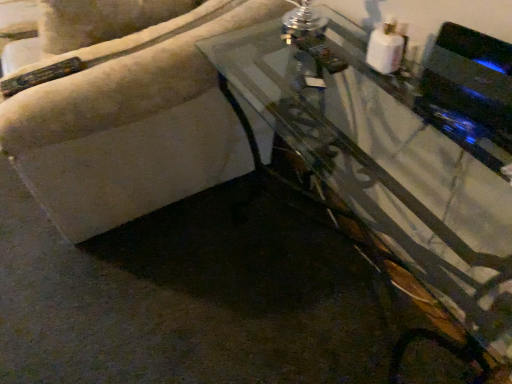
Question: From the image's perspective, is black glossy speaker at upper right located beneath transparent glass table at center?

Choices:
 (A) yes
 (B) no

Answer: (B)

Question: Is black glossy speaker at upper right positioned before transparent glass table at center?

Choices:
 (A) yes
 (B) no

Answer: (B)

Question: Is black glossy speaker at upper right in contact with transparent glass table at center?

Choices:
 (A) no
 (B) yes

Answer: (A)

Question: Is black glossy speaker at upper right thinner than transparent glass table at center?

Choices:
 (A) no
 (B) yes

Answer: (B)

Question: Can you confirm if black glossy speaker at upper right is positioned to the left of transparent glass table at center?

Choices:
 (A) yes
 (B) no

Answer: (B)

Question: From a real-world perspective, is black glossy speaker at upper right under transparent glass table at center?

Choices:
 (A) yes
 (B) no

Answer: (B)

Question: Considering the relative sizes of transparent glass table at center and black glossy speaker at upper right in the image provided, is transparent glass table at center taller than black glossy speaker at upper right?

Choices:
 (A) yes
 (B) no

Answer: (A)

Question: Does transparent glass table at center have a larger size compared to black glossy speaker at upper right?

Choices:
 (A) yes
 (B) no

Answer: (A)

Question: From the image's perspective, is transparent glass table at center above black glossy speaker at upper right?

Choices:
 (A) yes
 (B) no

Answer: (B)

Question: Could you tell me if transparent glass table at center is facing black glossy speaker at upper right?

Choices:
 (A) no
 (B) yes

Answer: (A)

Question: Does transparent glass table at center have a greater width compared to black glossy speaker at upper right?

Choices:
 (A) no
 (B) yes

Answer: (B)

Question: Would you consider transparent glass table at center to be distant from black glossy speaker at upper right?

Choices:
 (A) no
 (B) yes

Answer: (A)

Question: In terms of height, does transparent glass table at center look taller or shorter compared to black glossy speaker at upper right?

Choices:
 (A) short
 (B) tall

Answer: (B)